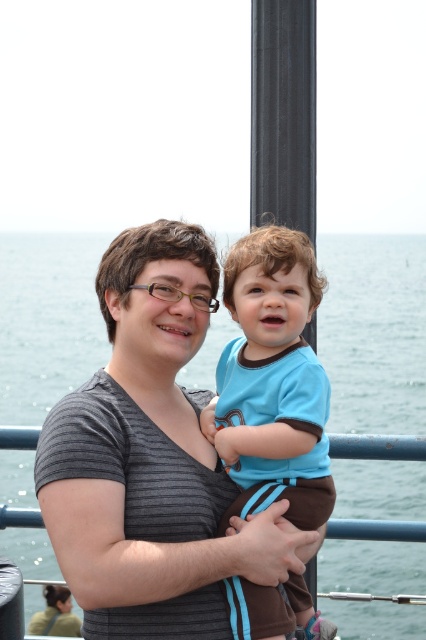
Question: Which point appears farthest from the camera in this image?

Choices:
 (A) (57, 289)
 (B) (291, 588)

Answer: (A)

Question: Considering the relative positions of blue water at center and blue cotton shirt at center in the image provided, where is blue water at center located with respect to blue cotton shirt at center?

Choices:
 (A) right
 (B) left

Answer: (A)

Question: Among these points, which one is nearest to the camera?

Choices:
 (A) (276, 404)
 (B) (394, 333)

Answer: (A)

Question: Which of the following is the closest to the observer?

Choices:
 (A) blue cotton shirt at center
 (B) blue water at center

Answer: (A)

Question: Is blue water at center thinner than blue cotton shirt at center?

Choices:
 (A) yes
 (B) no

Answer: (B)

Question: Does blue water at center appear under blue cotton shirt at center?

Choices:
 (A) no
 (B) yes

Answer: (A)